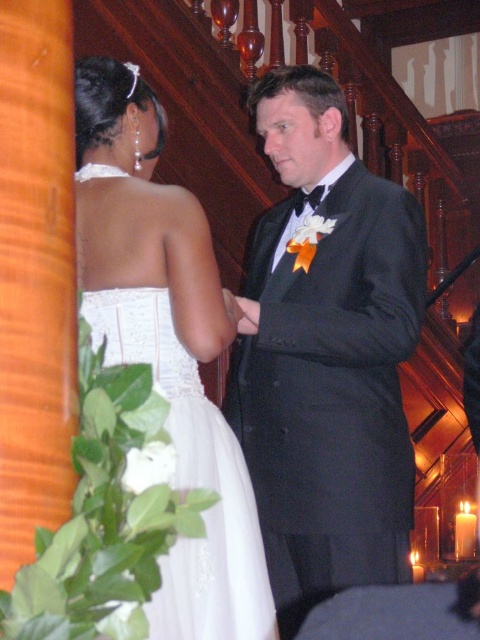
Question: Observing the image, what is the correct spatial positioning of black satin tuxedo at center in reference to white satin dress at center?

Choices:
 (A) right
 (B) left

Answer: (A)

Question: Does black satin tuxedo at center appear under white satin dress at center?

Choices:
 (A) yes
 (B) no

Answer: (A)

Question: Is black satin tuxedo at center thinner than white satin dress at center?

Choices:
 (A) no
 (B) yes

Answer: (A)

Question: Which point is farther from the camera taking this photo?

Choices:
 (A) (351, 198)
 (B) (169, 378)

Answer: (A)